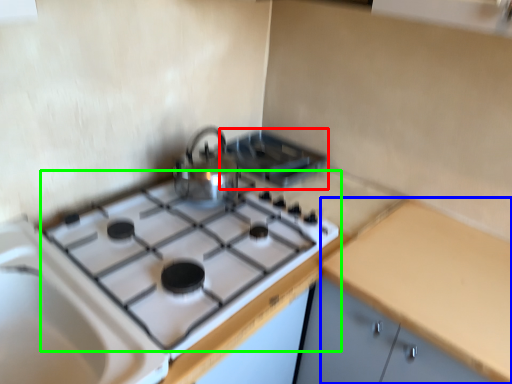
Question: Which object is the farthest from appliance (highlighted by a red box)? Choose among these: counter top (highlighted by a blue box) or gas stove (highlighted by a green box).

Choices:
 (A) counter top
 (B) gas stove

Answer: (A)